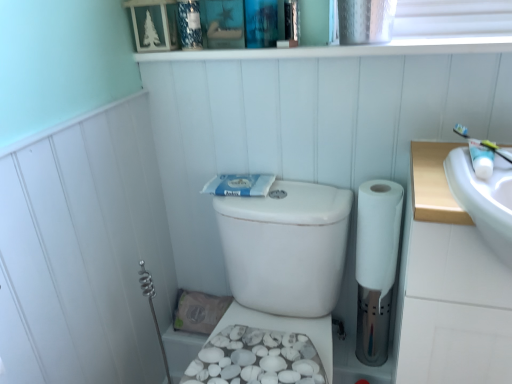
Question: Does white textured bidet at lower center have a lesser height compared to blue matte toothpaste at center?

Choices:
 (A) no
 (B) yes

Answer: (A)

Question: Is blue matte toothpaste at center a part of white textured bidet at lower center?

Choices:
 (A) no
 (B) yes

Answer: (A)

Question: From a real-world perspective, is white textured bidet at lower center positioned under blue matte toothpaste at center based on gravity?

Choices:
 (A) yes
 (B) no

Answer: (A)

Question: Is white textured bidet at lower center not within blue matte toothpaste at center?

Choices:
 (A) no
 (B) yes

Answer: (B)

Question: Is white textured bidet at lower center with blue matte toothpaste at center?

Choices:
 (A) yes
 (B) no

Answer: (B)

Question: Based on their sizes in the image, would you say white textured bidet at lower center is bigger or smaller than blue textured candle at upper center, the 2th toiletry positioned from the front?

Choices:
 (A) big
 (B) small

Answer: (A)

Question: Looking at their shapes, would you say white textured bidet at lower center is wider or thinner than blue textured candle at upper center, the first toiletry viewed from the top?

Choices:
 (A) wide
 (B) thin

Answer: (A)

Question: Is white textured bidet at lower center inside the boundaries of blue textured candle at upper center, the 2th toiletry viewed from the right, or outside?

Choices:
 (A) outside
 (B) inside

Answer: (A)

Question: Relative to blue textured candle at upper center, which is counted as the first toiletry, starting from the left, is white textured bidet at lower center in front or behind?

Choices:
 (A) behind
 (B) front

Answer: (A)

Question: Is blue textured candle at upper center, the 2th toiletry viewed from the right, inside or outside of white textured bidet at lower center?

Choices:
 (A) outside
 (B) inside

Answer: (A)

Question: In the image, is blue textured candle at upper center, the 2th toiletry viewed from the right, on the left side or the right side of white textured bidet at lower center?

Choices:
 (A) right
 (B) left

Answer: (B)

Question: In terms of height, does blue textured candle at upper center, marked as the 2th toiletry in a bottom-to-top arrangement, look taller or shorter compared to white textured bidet at lower center?

Choices:
 (A) tall
 (B) short

Answer: (A)

Question: Looking at their shapes, would you say blue textured candle at upper center, which is counted as the first toiletry, starting from the left, is wider or thinner than white textured bidet at lower center?

Choices:
 (A) thin
 (B) wide

Answer: (A)

Question: Based on their sizes in the image, would you say white glossy toothpaste tube at upper right, the 2th toiletry from the back, is bigger or smaller than blue textured candle at upper center, marked as the 1th toiletry in a back-to-front arrangement?

Choices:
 (A) big
 (B) small

Answer: (B)

Question: Considering their positions, is white glossy toothpaste tube at upper right, which ranks as the first toiletry in bottom-to-top order, located in front of or behind blue textured candle at upper center, which is counted as the first toiletry, starting from the left?

Choices:
 (A) front
 (B) behind

Answer: (A)